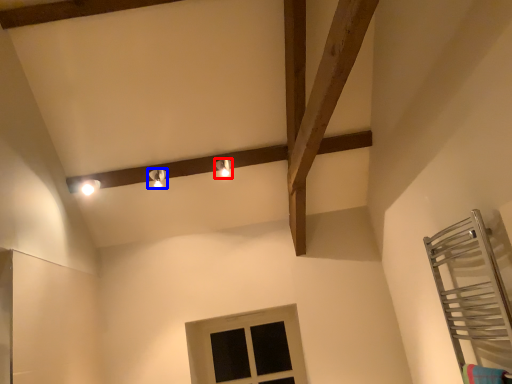
Question: Which of the following is the farthest to the observer, light fixture (highlighted by a red box) or light fixture (highlighted by a blue box)?

Choices:
 (A) light fixture
 (B) light fixture

Answer: (A)